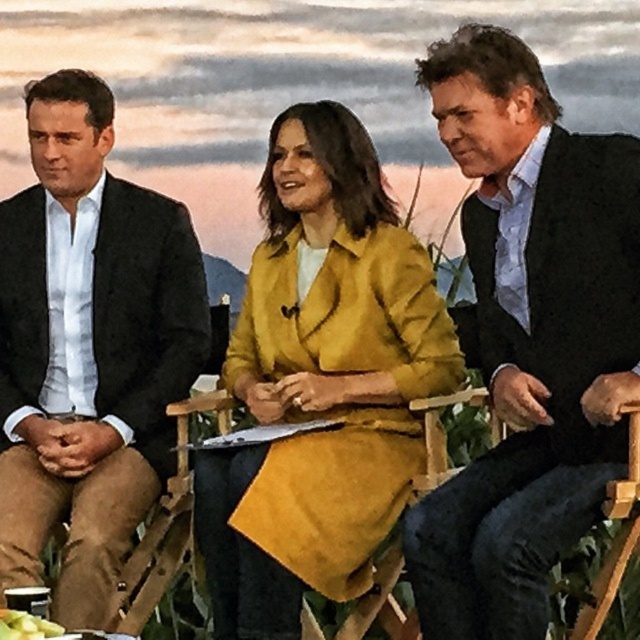
You are a photographer setting up a tripod to capture a group photo of the matte yellow coat at center and the matte black suit at left. The minimum distance your camera can focus clearly is 24 inches. Will you need to adjust the position of the tripod to ensure both subjects are in focus?

The distance between the matte yellow coat at center and the matte black suit at left is 25.78 inches, which exceeds the camera minimum focus distance of 24 inches. Therefore, the photographer does not need to adjust the tripod position as the subjects are within the focus range.

You are a photographer setting up for a panel discussion. You need to adjust the height of the camera to capture both the matte black suit at center and the matte black suit at left in focus. Which suit requires the camera to be focused at a higher level?

The matte black suit at center requires the camera to be focused at a higher level since it is much taller than the matte black suit at left.